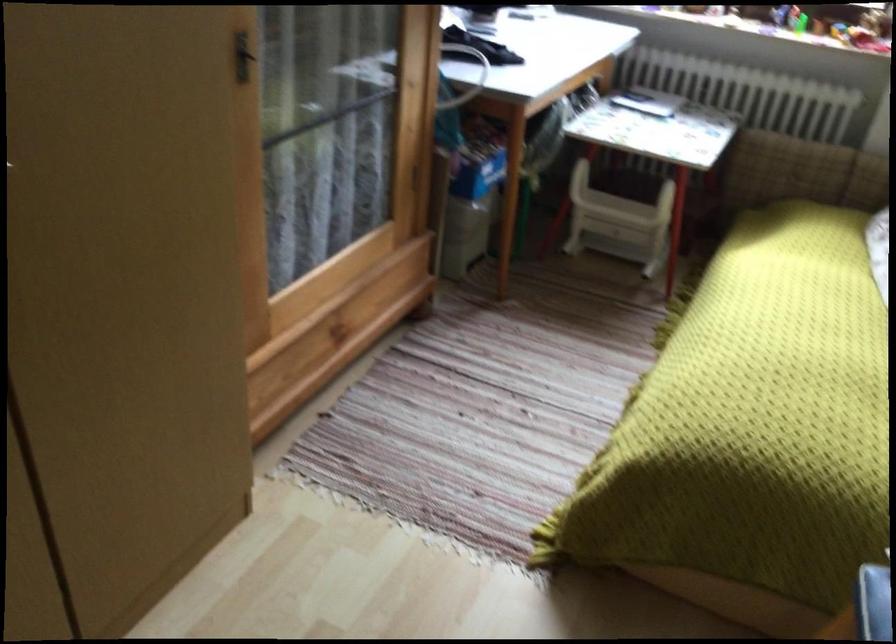
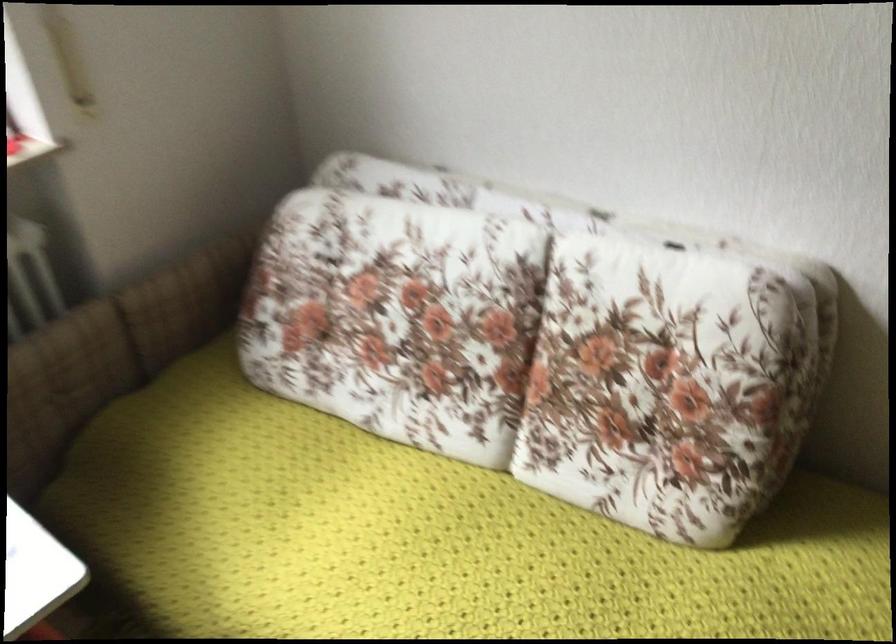
Where in the second image is the point corresponding to point 796,160 from the first image?

(63, 384)